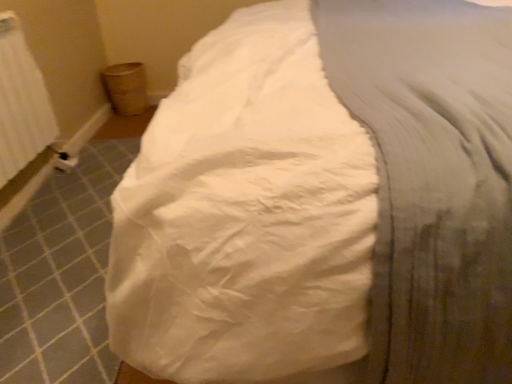
Question: Considering the relative sizes of white textured radiator at left and white cotton sheet at center in the image provided, is white textured radiator at left bigger than white cotton sheet at center?

Choices:
 (A) no
 (B) yes

Answer: (A)

Question: Does white textured radiator at left have a smaller size compared to white cotton sheet at center?

Choices:
 (A) yes
 (B) no

Answer: (A)

Question: Does white textured radiator at left have a greater height compared to white cotton sheet at center?

Choices:
 (A) no
 (B) yes

Answer: (A)

Question: Would you say white textured radiator at left is a long distance from white cotton sheet at center?

Choices:
 (A) no
 (B) yes

Answer: (B)

Question: Is white textured radiator at left at the left side of white cotton sheet at center?

Choices:
 (A) no
 (B) yes

Answer: (B)

Question: Can you confirm if white textured radiator at left is wider than white cotton sheet at center?

Choices:
 (A) no
 (B) yes

Answer: (A)

Question: Is white cotton sheet at center at the right side of white textured radiator at left?

Choices:
 (A) no
 (B) yes

Answer: (B)

Question: Does white cotton sheet at center have a greater height compared to white textured radiator at left?

Choices:
 (A) yes
 (B) no

Answer: (A)

Question: Would you say white cotton sheet at center is a long distance from white textured radiator at left?

Choices:
 (A) yes
 (B) no

Answer: (A)

Question: From the image's perspective, is white cotton sheet at center above white textured radiator at left?

Choices:
 (A) yes
 (B) no

Answer: (B)

Question: Is the position of white cotton sheet at center more distant than that of white textured radiator at left?

Choices:
 (A) yes
 (B) no

Answer: (B)

Question: Considering the relative sizes of white cotton sheet at center and white textured radiator at left in the image provided, is white cotton sheet at center thinner than white textured radiator at left?

Choices:
 (A) yes
 (B) no

Answer: (B)

Question: From the image's perspective, relative to white textured radiator at left, is white cotton sheet at center above or below?

Choices:
 (A) below
 (B) above

Answer: (A)